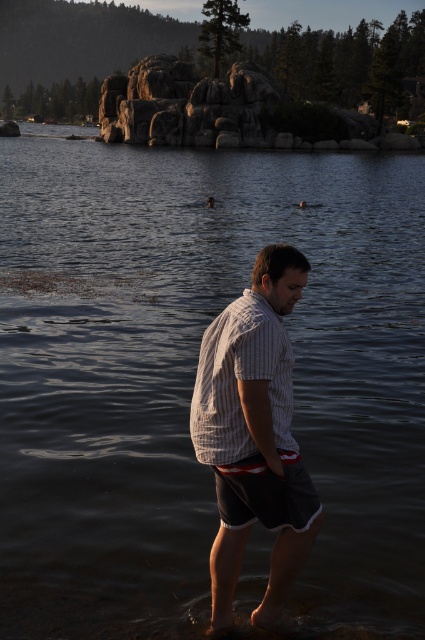
Can you confirm if striped cotton shirt at center is positioned to the right of dark gray cotton shorts at center?

No, striped cotton shirt at center is not to the right of dark gray cotton shorts at center.

Based on the photo, between striped cotton shirt at center and dark gray cotton shorts at center, which one appears on the left side from the viewer's perspective?

From the viewer's perspective, striped cotton shirt at center appears more on the left side.

Describe the element at coordinates (254, 435) in the screenshot. I see `striped cotton shirt at center` at that location.

Image resolution: width=425 pixels, height=640 pixels. Identify the location of striped cotton shirt at center. (254, 435).

Based on the photo, is striped cotton shirt at center positioned in front of white striped shirt at center?

No.

Between striped cotton shirt at center and white striped shirt at center, which one is positioned lower?

striped cotton shirt at center is lower down.

Identify the location of striped cotton shirt at center. This screenshot has width=425, height=640. (254, 435).

At what (x,y) coordinates should I click in order to perform the action: click on striped cotton shirt at center. Please return your answer as a coordinate pair (x, y). The width and height of the screenshot is (425, 640). Looking at the image, I should click on [254, 435].

Which is more to the right, white striped shirt at center or dark gray cotton shorts at center?

dark gray cotton shorts at center

Can you confirm if white striped shirt at center is wider than dark gray cotton shorts at center?

Yes.

The height and width of the screenshot is (640, 425). In order to click on white striped shirt at center in this screenshot , I will do `click(240, 380)`.

Identify the location of white striped shirt at center. 240,380.